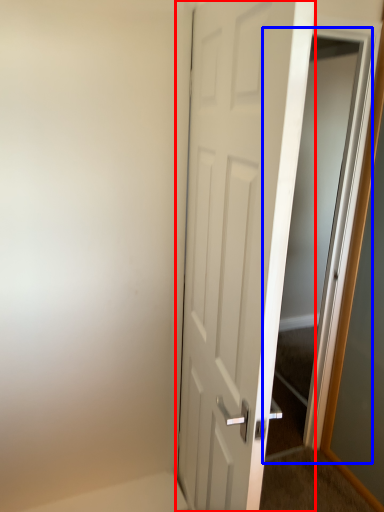
Question: Among these objects, which one is farthest to the camera, door (highlighted by a red box) or elevator (highlighted by a blue box)?

Choices:
 (A) door
 (B) elevator

Answer: (B)